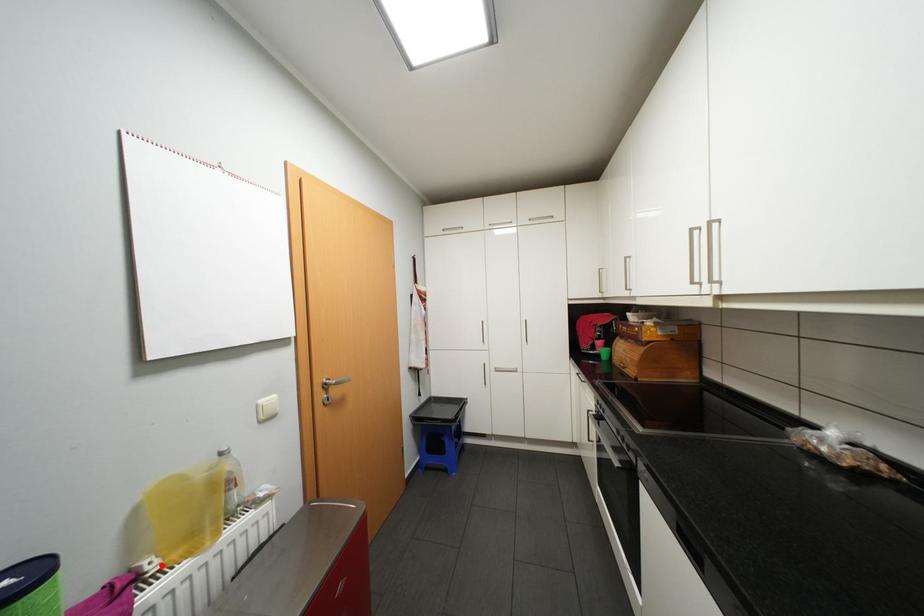
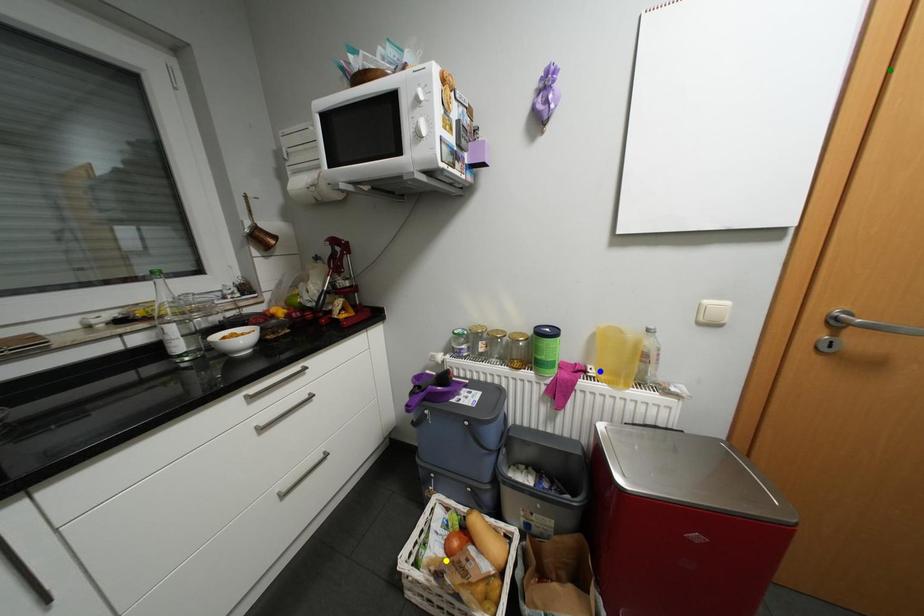
Question: I am providing you with two images of the same scene from different viewpoints. A red point is marked on the first image. You are given multiple points on the second image. Which mark in image 2 goes with the point in image 1?

Choices:
 (A) blue point
 (B) yellow point
 (C) green point

Answer: (A)